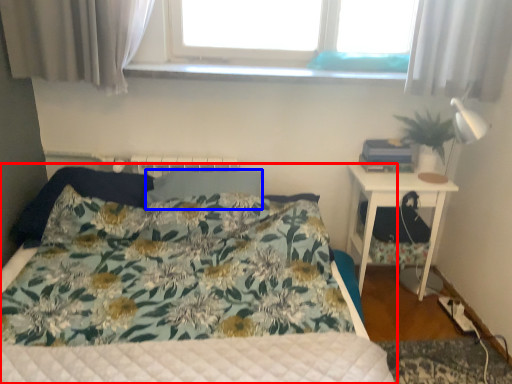
Question: Among these objects, which one is farthest to the camera, bed (highlighted by a red box) or pillow (highlighted by a blue box)?

Choices:
 (A) bed
 (B) pillow

Answer: (B)